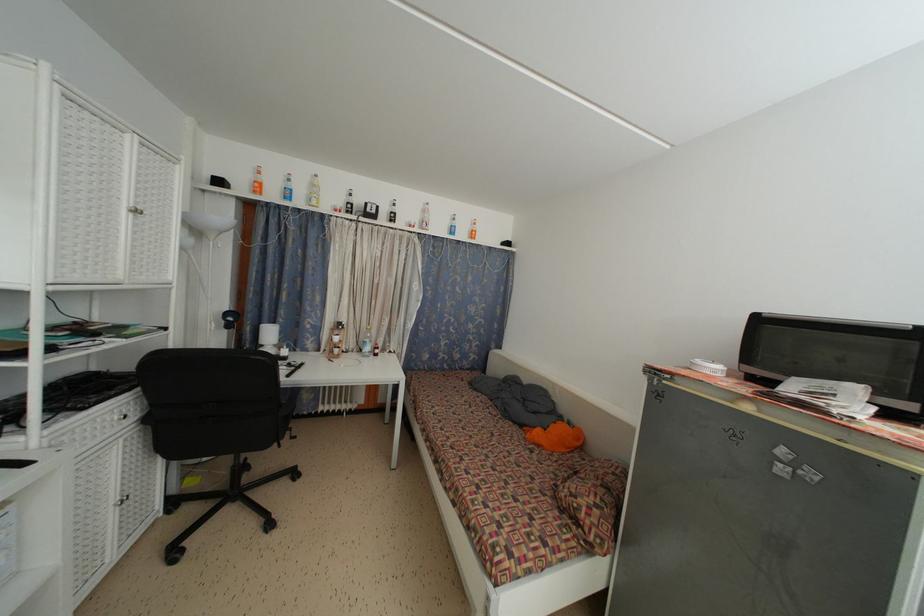
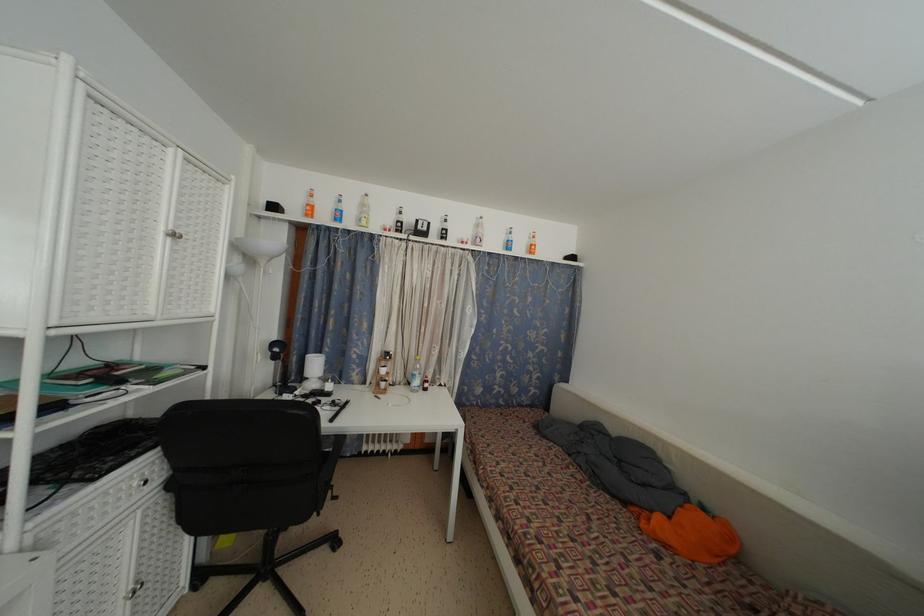
Question: The camera is either moving clockwise (left) or counter-clockwise (right) around the object. The first image is from the beginning of the video and the second image is from the end. Is the camera moving left or right when shooting the video?

Choices:
 (A) Left
 (B) Right

Answer: (B)